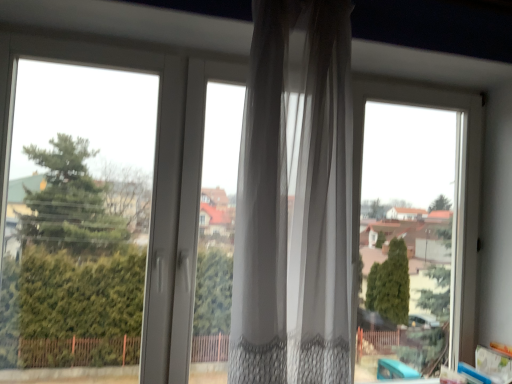
Image resolution: width=512 pixels, height=384 pixels. I want to click on sheer white curtain at center, so click(x=295, y=200).

Describe the element at coordinates (295, 200) in the screenshot. This screenshot has height=384, width=512. I see `sheer white curtain at center` at that location.

Measure the distance between point (304, 196) and camera.

Point (304, 196) and camera are 4.13 feet apart from each other.

At what (x,y) coordinates should I click in order to perform the action: click on sheer white curtain at center. Please return your answer as a coordinate pair (x, y). The height and width of the screenshot is (384, 512). Looking at the image, I should click on click(x=295, y=200).